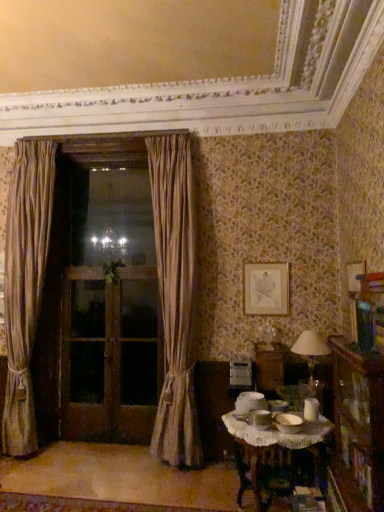
Image resolution: width=384 pixels, height=512 pixels. In order to click on white fabric lampshade at right in this screenshot , I will do `click(311, 353)`.

Locate an element on the screen. The height and width of the screenshot is (512, 384). matte silver picture frame at upper center is located at coordinates (266, 289).

Measure the distance between white lace tablecloth at lower right and camera.

The distance of white lace tablecloth at lower right from camera is 2.37 meters.

The width and height of the screenshot is (384, 512). Describe the element at coordinates (25, 284) in the screenshot. I see `silky beige curtain at left, the 1th curtain from the left` at that location.

The height and width of the screenshot is (512, 384). Identify the location of wooden bookcase at lower right. (358, 426).

Which is closer, (74, 330) or (45, 250)?

Answer: Point (74, 330) appears to be farther away from the viewer than point (45, 250).

Can you confirm if brown wooden screen door at left, which ranks as the third screen door in right-to-left order, is thinner than silky beige curtain at left, the 1th curtain from the left?

Indeed, brown wooden screen door at left, which ranks as the third screen door in right-to-left order, has a lesser width compared to silky beige curtain at left, the 1th curtain from the left.

In the scene shown: In terms of size, does brown wooden screen door at center, the 1th screen door positioned from the right, appear bigger or smaller than white lace tablecloth at lower right?

In the image, brown wooden screen door at center, the 1th screen door positioned from the right, appears to be smaller than white lace tablecloth at lower right.

Is brown wooden screen door at center, the 3th screen door from the left, situated inside white lace tablecloth at lower right or outside?

brown wooden screen door at center, the 3th screen door from the left, cannot be found inside white lace tablecloth at lower right.

Is brown wooden screen door at center, the 1th screen door positioned from the right, looking in the opposite direction of white lace tablecloth at lower right?

No, brown wooden screen door at center, the 1th screen door positioned from the right,'s orientation is not away from white lace tablecloth at lower right.

From a real-world perspective, which is physically above, brown wooden screen door at center, the 1th screen door positioned from the right, or white lace tablecloth at lower right?

brown wooden screen door at center, the 1th screen door positioned from the right, is physically above.

How different are the orientations of brown wooden screen door at left, which ranks as the third screen door in right-to-left order, and brown wooden screen door at left, the second screen door from the right, in degrees?

0.000836 degrees separate the facing orientations of brown wooden screen door at left, which ranks as the third screen door in right-to-left order, and brown wooden screen door at left, the second screen door from the right.

Which point is more distant from viewer, (74, 366) or (65, 374)?

Point (74, 366)

Is brown wooden screen door at left, which is counted as the first screen door, starting from the left, facing away from brown wooden screen door at left, the second screen door from the right?

Yes, brown wooden screen door at left, the second screen door from the right, is at the back of brown wooden screen door at left, which is counted as the first screen door, starting from the left.

Is brown wooden screen door at left, which ranks as the third screen door in right-to-left order, far from brown wooden screen door at left, the second screen door from the right?

brown wooden screen door at left, which ranks as the third screen door in right-to-left order, is near brown wooden screen door at left, the second screen door from the right, not far away.

Which is correct: brown wooden screen door at left, which ranks as the third screen door in right-to-left order, is inside white fabric lampshade at right, or outside of it?

The correct answer is: outside.

From a real-world perspective, which is physically below, brown wooden screen door at left, which is counted as the first screen door, starting from the left, or white fabric lampshade at right?

brown wooden screen door at left, which is counted as the first screen door, starting from the left, from a real-world perspective.

Who is more distant, brown wooden screen door at left, which ranks as the third screen door in right-to-left order, or white fabric lampshade at right?

brown wooden screen door at left, which ranks as the third screen door in right-to-left order, is further away from the camera.

The image size is (384, 512). I want to click on curtain that is the 2nd object located behind the white lace tablecloth at lower right, so click(x=25, y=284).

Is white lace tablecloth at lower right at the right side of silky beige curtain at left, marked as the 2th curtain in a right-to-left arrangement?

Yes, white lace tablecloth at lower right is to the right of silky beige curtain at left, marked as the 2th curtain in a right-to-left arrangement.

Consider the image. From the image's perspective, who appears lower, white lace tablecloth at lower right or silky beige curtain at left, marked as the 2th curtain in a right-to-left arrangement?

white lace tablecloth at lower right.

At what (x,y) coordinates should I click in order to perform the action: click on the 2nd screen door directly beneath the brown wooden screen door at left, arranged as the 2th screen door when viewed from the left (from a real-world perspective). Please return your answer as a coordinate pair (x, y). The width and height of the screenshot is (384, 512). Looking at the image, I should click on (136, 359).

Between brown wooden screen door at center, the 1th screen door positioned from the right, and brown wooden screen door at left, the second screen door from the right, which one has larger width?

With larger width is brown wooden screen door at center, the 1th screen door positioned from the right.

Is the position of brown wooden screen door at center, the 3th screen door from the left, more distant than that of brown wooden screen door at left, arranged as the 2th screen door when viewed from the left?

No.

From the image's perspective, is brown wooden screen door at center, the 3th screen door from the left, on brown wooden screen door at left, arranged as the 2th screen door when viewed from the left?

Incorrect, from the image's perspective, brown wooden screen door at center, the 3th screen door from the left, is lower than brown wooden screen door at left, arranged as the 2th screen door when viewed from the left.

Does point (335, 462) lie in front of point (26, 198)?

Yes, it is in front of point (26, 198).

In the image, is wooden bookcase at lower right positioned in front of or behind silky beige curtain at left, marked as the 2th curtain in a right-to-left arrangement?

wooden bookcase at lower right is in front of silky beige curtain at left, marked as the 2th curtain in a right-to-left arrangement.

Considering the relative sizes of wooden bookcase at lower right and silky beige curtain at left, marked as the 2th curtain in a right-to-left arrangement, in the image provided, is wooden bookcase at lower right shorter than silky beige curtain at left, marked as the 2th curtain in a right-to-left arrangement,?

Yes.

I want to click on the 2nd screen door directly beneath the silky beige curtain at left, the 1th curtain from the left (from a real-world perspective), so click(x=86, y=358).

Identify the location of the 2nd screen door positioned above the white lace tablecloth at lower right (from the image's perspective). (136, 359).

Considering their positions, is white fabric lampshade at right positioned closer to brown wooden screen door at left, arranged as the 2th screen door when viewed from the left, than matte silver picture frame at upper center?

Based on the image, matte silver picture frame at upper center appears to be nearer to brown wooden screen door at left, arranged as the 2th screen door when viewed from the left.

Estimate the real-world distances between objects in this image. Which object is further from white fabric lampshade at right, silky beige curtain at center, which is the 2th curtain in left-to-right order, or silky beige curtain at left, the 1th curtain from the left?

Based on the image, silky beige curtain at left, the 1th curtain from the left, appears to be further to white fabric lampshade at right.

From the picture: Looking at the image, which one is located further to silky beige curtain at center, which is the 2th curtain in left-to-right order, brown wooden screen door at center, the 1th screen door positioned from the right, or matte silver picture frame at upper center?

Among the two, brown wooden screen door at center, the 1th screen door positioned from the right, is located further to silky beige curtain at center, which is the 2th curtain in left-to-right order.

Estimate the real-world distances between objects in this image. Which object is further from silky beige curtain at center, which is the 2th curtain in left-to-right order, brown wooden screen door at left, arranged as the 2th screen door when viewed from the left, or white lace tablecloth at lower right?

white lace tablecloth at lower right is positioned further to the anchor silky beige curtain at center, which is the 2th curtain in left-to-right order.

Considering their positions, is white fabric lampshade at right positioned further to brown wooden screen door at left, arranged as the 2th screen door when viewed from the left, than brown wooden screen door at left, which is counted as the first screen door, starting from the left?

white fabric lampshade at right is positioned further to the anchor brown wooden screen door at left, arranged as the 2th screen door when viewed from the left.

From the image, which object appears to be nearer to white lace tablecloth at lower right, brown wooden screen door at left, the second screen door from the right, or matte silver picture frame at upper center?

matte silver picture frame at upper center is positioned closer to the anchor white lace tablecloth at lower right.

Based on their spatial positions, is silky beige curtain at left, the 1th curtain from the left, or wooden bookcase at lower right further from white lace tablecloth at lower right?

silky beige curtain at left, the 1th curtain from the left.

Which object lies nearer to the anchor point matte silver picture frame at upper center, white fabric lampshade at right or wooden bookcase at lower right?

The object closer to matte silver picture frame at upper center is white fabric lampshade at right.

This screenshot has width=384, height=512. I want to click on table lamp positioned between white lace tablecloth at lower right and brown wooden screen door at center, the 3th screen door from the left, from near to far, so click(311, 353).

The image size is (384, 512). I want to click on curtain between silky beige curtain at left, the 1th curtain from the left, and white fabric lampshade at right, so click(175, 297).

Where is `table between brown wooden screen door at left, the second screen door from the right, and white fabric lampshade at right, in the horizontal direction`? The width and height of the screenshot is (384, 512). table between brown wooden screen door at left, the second screen door from the right, and white fabric lampshade at right, in the horizontal direction is located at coordinates (277, 455).

Identify the location of curtain situated between brown wooden screen door at left, which is counted as the first screen door, starting from the left, and white fabric lampshade at right from left to right. (175, 297).